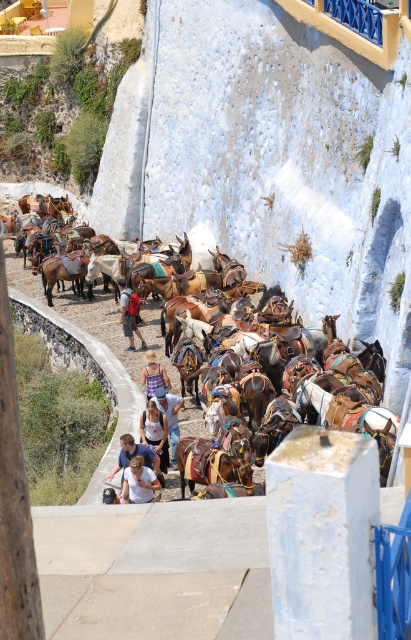
Question: Which object is positioned closest to the red backpack at center?

Choices:
 (A) white cotton shirt at lower center
 (B) purple cotton dress at center

Answer: (B)

Question: Which of these objects is positioned farthest from the white cotton shirt at lower center?

Choices:
 (A) brown leather saddle at center
 (B) light blue denim shirt at center

Answer: (A)

Question: From the image, what is the correct spatial relationship of brown leather saddle at center in relation to red backpack at center?

Choices:
 (A) right
 (B) left

Answer: (B)

Question: Can you confirm if brown leather saddle at center is bigger than light blue denim shirt at center?

Choices:
 (A) yes
 (B) no

Answer: (A)

Question: Which object is the farthest from the light blue denim shirt at center?

Choices:
 (A) red backpack at center
 (B) white cotton shirt at lower center
 (C) light blue denim shorts at center

Answer: (A)

Question: Is brown leather saddle at center thinner than denim shorts at center?

Choices:
 (A) yes
 (B) no

Answer: (B)